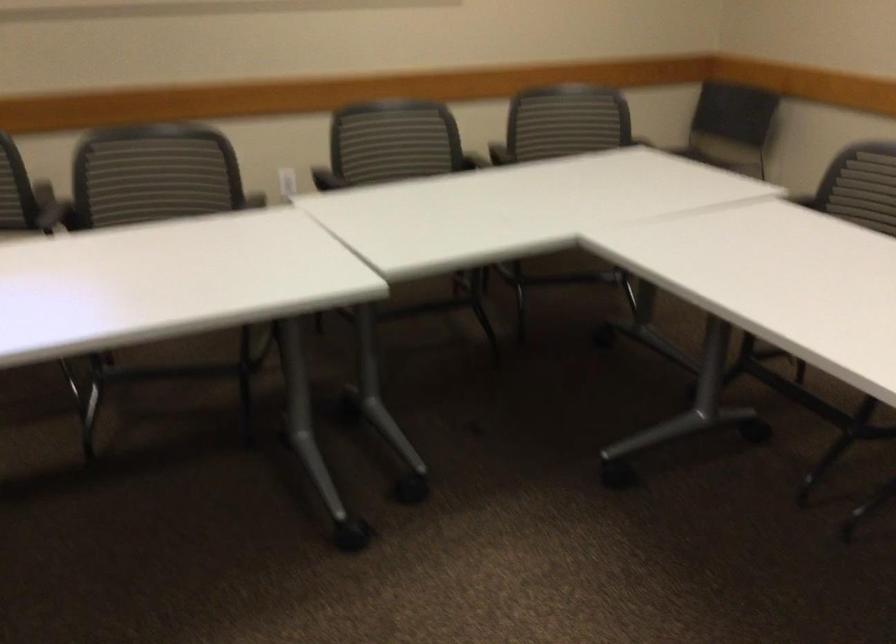
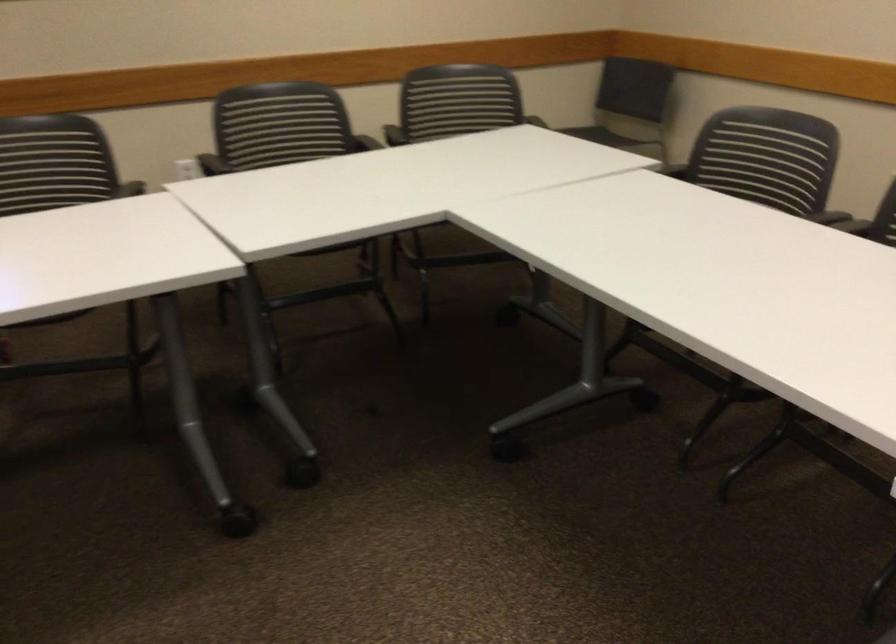
The point at (x=771, y=180) is marked in the first image. Where is the corresponding point in the second image?

(660, 158)